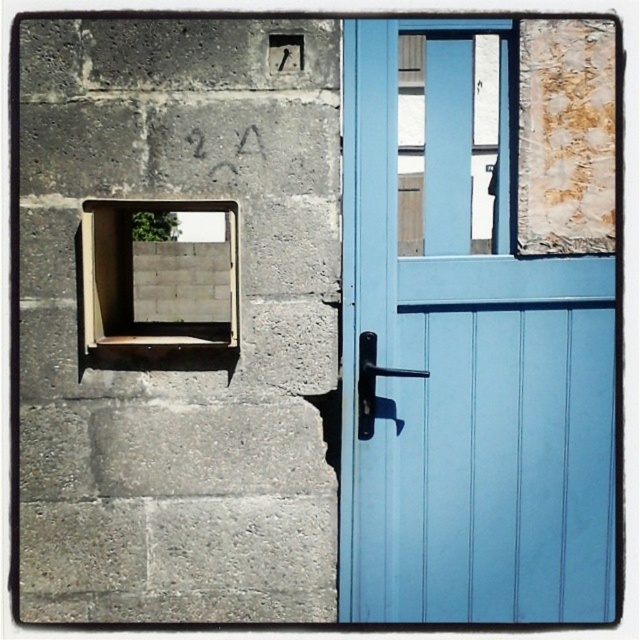
Between point (413, 529) and point (371, 332), which one is positioned in front?

Point (371, 332)

Where is `light blue wooden door at center`? light blue wooden door at center is located at coordinates (467, 371).

The image size is (640, 640). Describe the element at coordinates (467, 371) in the screenshot. I see `light blue wooden door at center` at that location.

Identify the location of light blue wooden door at center. This screenshot has width=640, height=640. (467, 371).

Who is higher up, matte glass window at left or polished metal door handle at center?

Positioned higher is matte glass window at left.

Which of these two, matte glass window at left or polished metal door handle at center, stands taller?

Standing taller between the two is matte glass window at left.

The width and height of the screenshot is (640, 640). Find the location of `matte glass window at left`. matte glass window at left is located at coordinates (132, 280).

Can you confirm if light blue wooden door at center is wider than matte glass window at left?

Indeed, light blue wooden door at center has a greater width compared to matte glass window at left.

Between light blue wooden door at center and matte glass window at left, which one is positioned higher?

matte glass window at left

Which is behind, point (436, 36) or point (90, 259)?

The point (436, 36) is more distant.

Image resolution: width=640 pixels, height=640 pixels. I want to click on light blue wooden door at center, so click(467, 371).